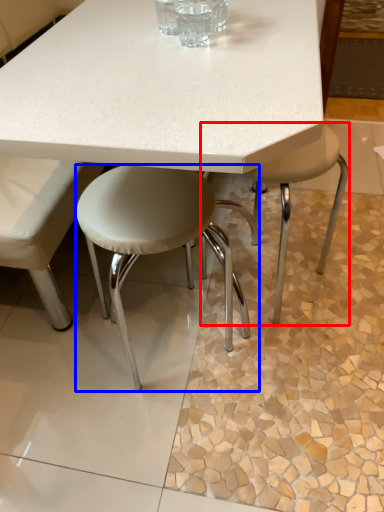
Question: Which object is further to the camera taking this photo, stool (highlighted by a red box) or stool (highlighted by a blue box)?

Choices:
 (A) stool
 (B) stool

Answer: (A)